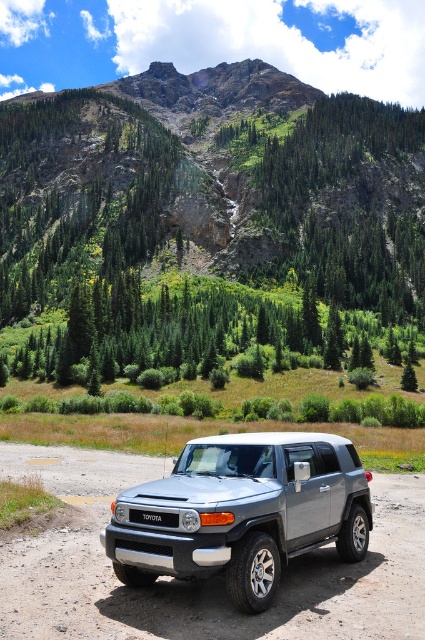
Question: Does green coniferous trees at upper center have a greater width compared to satin silver suv at center?

Choices:
 (A) no
 (B) yes

Answer: (B)

Question: Which of the following is the closest to the observer?

Choices:
 (A) (308, 502)
 (B) (388, 173)

Answer: (A)

Question: Does green coniferous trees at upper center have a larger size compared to satin silver suv at center?

Choices:
 (A) no
 (B) yes

Answer: (B)

Question: Which point is farther to the camera?

Choices:
 (A) green coniferous trees at upper center
 (B) satin silver suv at center

Answer: (A)

Question: Among these objects, which one is nearest to the camera?

Choices:
 (A) satin silver suv at center
 (B) green coniferous trees at upper center

Answer: (A)

Question: Is green coniferous trees at upper center wider than satin silver suv at center?

Choices:
 (A) yes
 (B) no

Answer: (A)